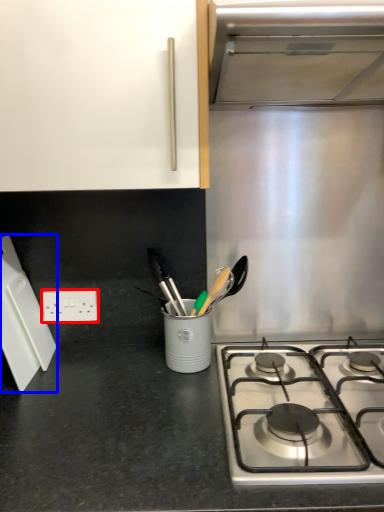
Question: Which object is further to the camera taking this photo, electric outlet (highlighted by a red box) or kitchen appliance (highlighted by a blue box)?

Choices:
 (A) electric outlet
 (B) kitchen appliance

Answer: (A)